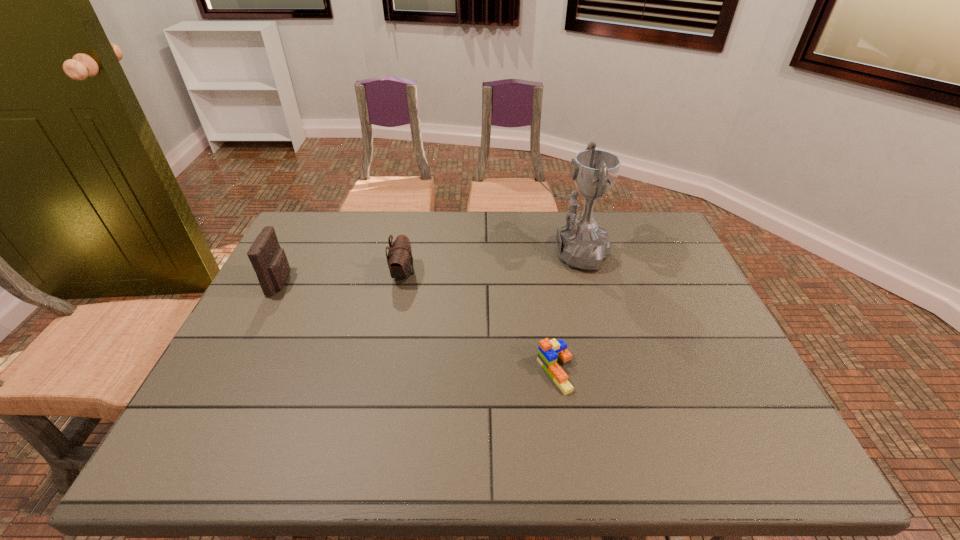
At what (x,y) coordinates should I click in order to perform the action: click on blank area located 0.380m with an open flap on the leftmost object. Please return your answer as a coordinate pair (x, y). Looking at the image, I should click on (421, 282).

Locate an element on the screen. free location located with the flap open on the shorter pouch is located at coordinates (479, 274).

Identify the location of vacant space located on the back of the shortest object. The width and height of the screenshot is (960, 540). (545, 307).

The height and width of the screenshot is (540, 960). Identify the location of object positioned at the far edge. (581, 243).

Image resolution: width=960 pixels, height=540 pixels. I want to click on object present at the left edge, so click(268, 259).

I want to click on vacant space at the far edge of the desktop, so click(501, 222).

I want to click on free space at the near edge, so click(356, 443).

The height and width of the screenshot is (540, 960). In the image, there is a desktop. Find the location of `blank space at the right edge`. blank space at the right edge is located at coordinates (660, 256).

In the image, there is a desktop. Find the location of `vacant space at the far left corner`. vacant space at the far left corner is located at coordinates (311, 246).

You are a GUI agent. You are given a task and a screenshot of the screen. Output one action in this format:
    pyautogui.click(x=<x>, y=<y>)
    Task: Click on the blank space at the far right corner of the desktop
    The height and width of the screenshot is (540, 960).
    Given the screenshot: What is the action you would take?
    pyautogui.click(x=657, y=227)